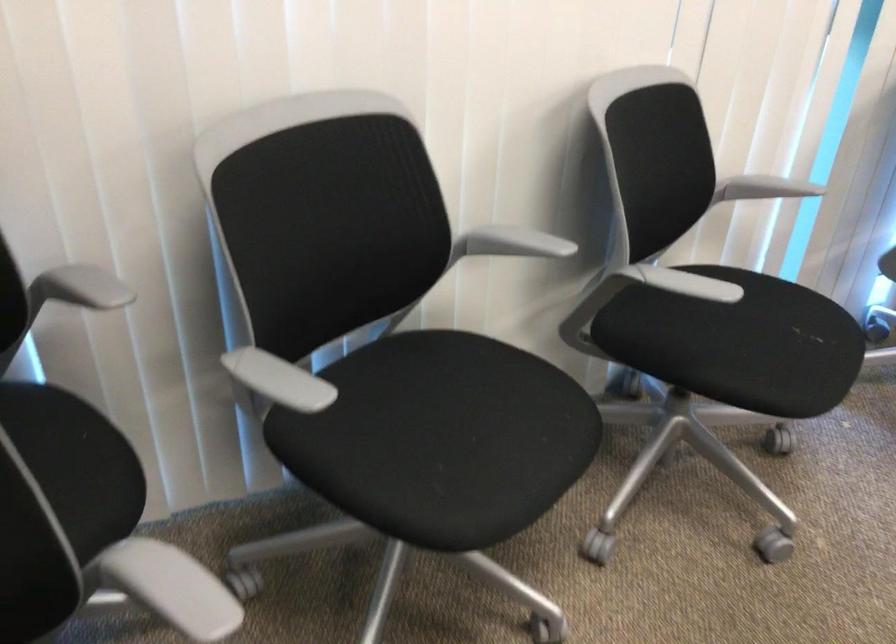
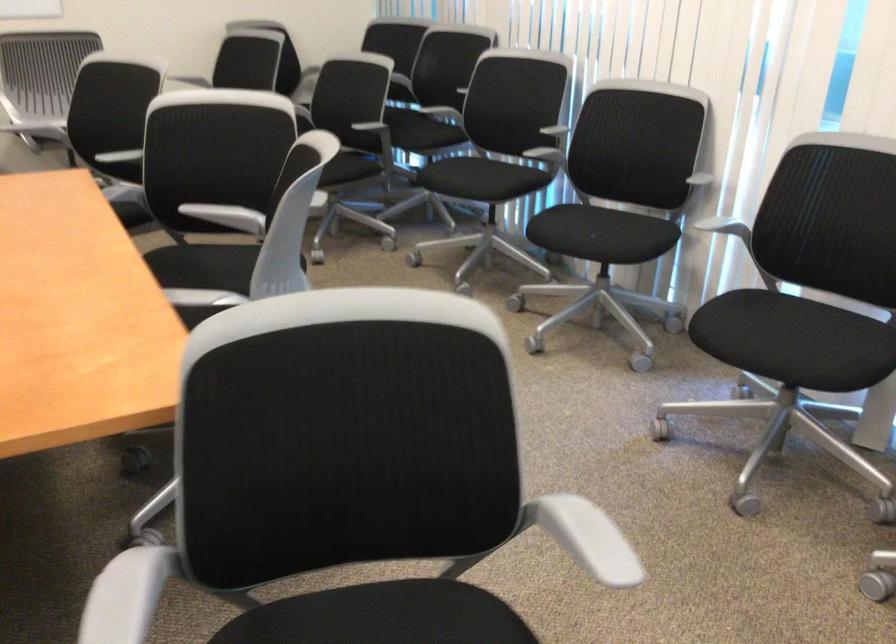
Find the pixel in the second image that matches [501,422] in the first image.

(480, 178)